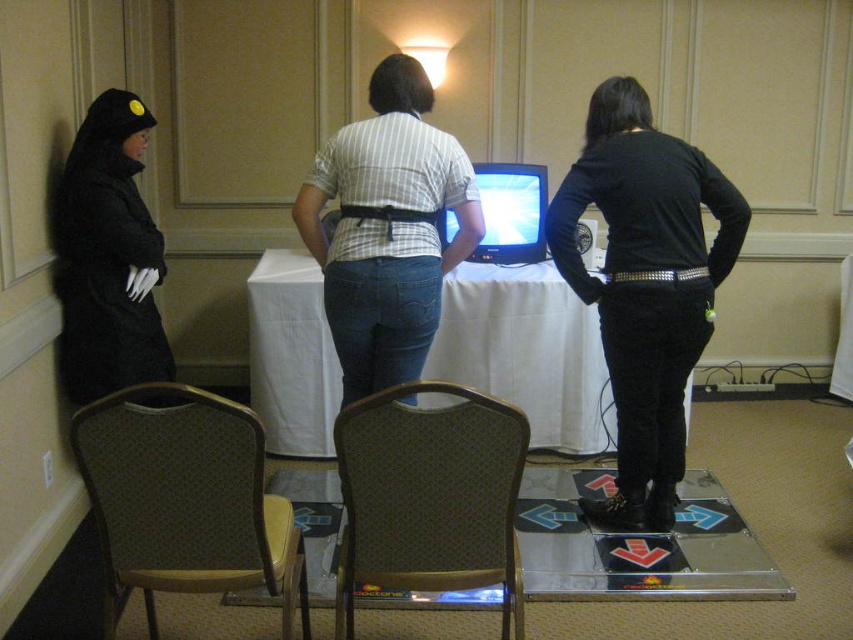
Who is shorter, brown fabric chair at lower left or brown fabric chair at lower center?

brown fabric chair at lower left

Describe the element at coordinates (184, 500) in the screenshot. I see `brown fabric chair at lower left` at that location.

In order to click on brown fabric chair at lower left in this screenshot , I will do `click(184, 500)`.

Does white striped shirt at center have a greater width compared to black matte coat at left?

Yes, white striped shirt at center is wider than black matte coat at left.

Does white striped shirt at center appear on the left side of black matte coat at left?

No, white striped shirt at center is not to the left of black matte coat at left.

The height and width of the screenshot is (640, 853). Identify the location of white striped shirt at center. (387, 228).

Which is more to the left, white striped shirt at center or matte plastic television at center?

Positioned to the left is white striped shirt at center.

Describe the element at coordinates (387, 228) in the screenshot. I see `white striped shirt at center` at that location.

At what (x,y) coordinates should I click in order to perform the action: click on white striped shirt at center. Please return your answer as a coordinate pair (x, y). Image resolution: width=853 pixels, height=640 pixels. Looking at the image, I should click on (387, 228).